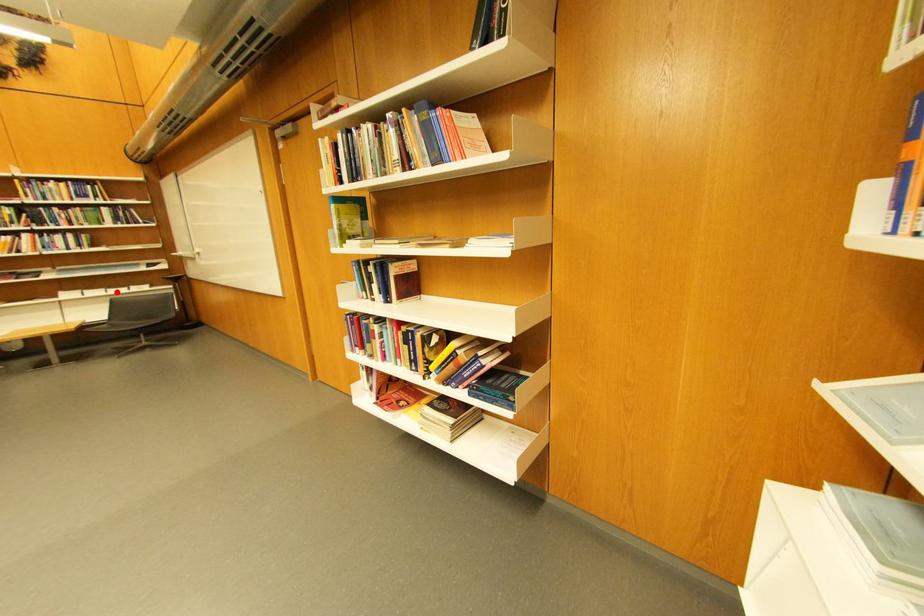
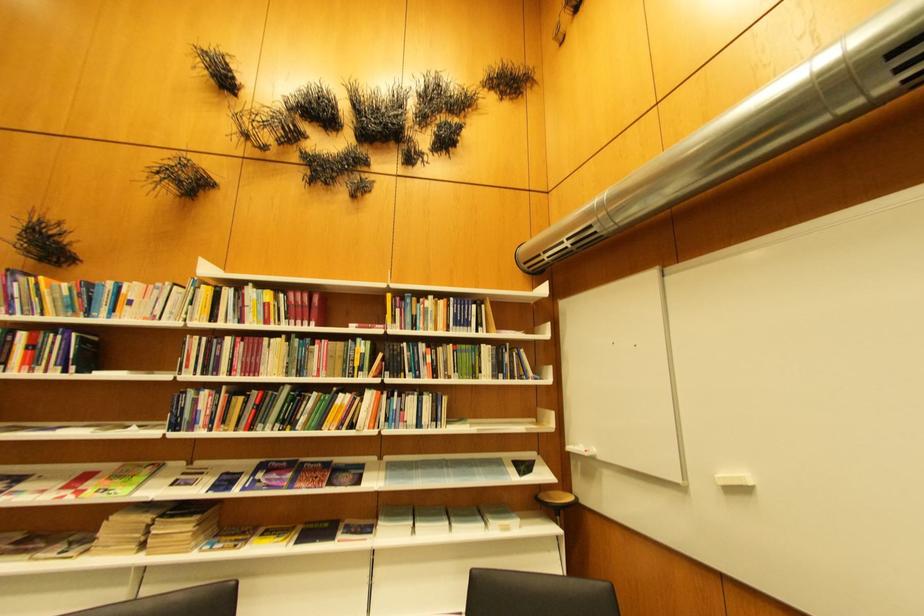
Locate, in the second image, the point that corresponds to the highlighted location in the first image.

(460, 527)